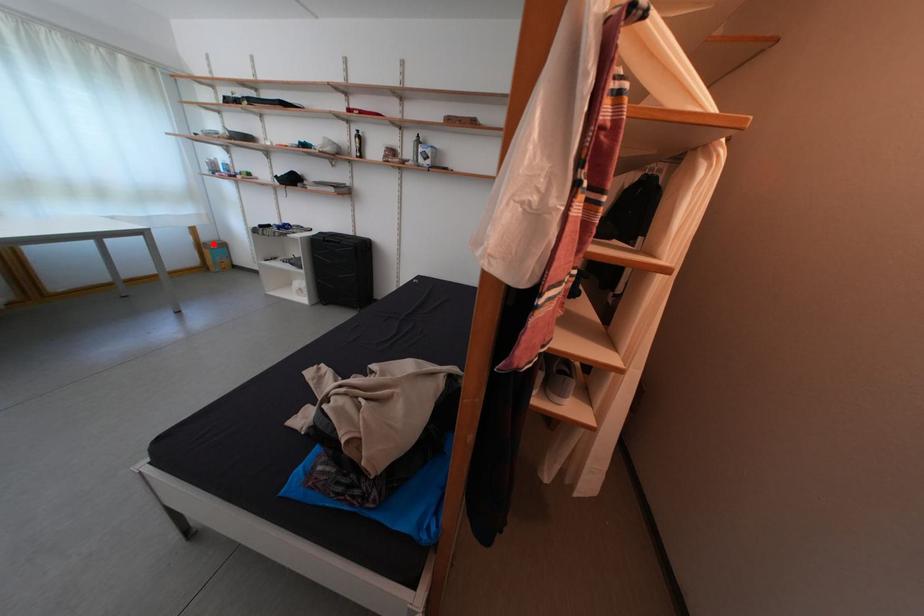
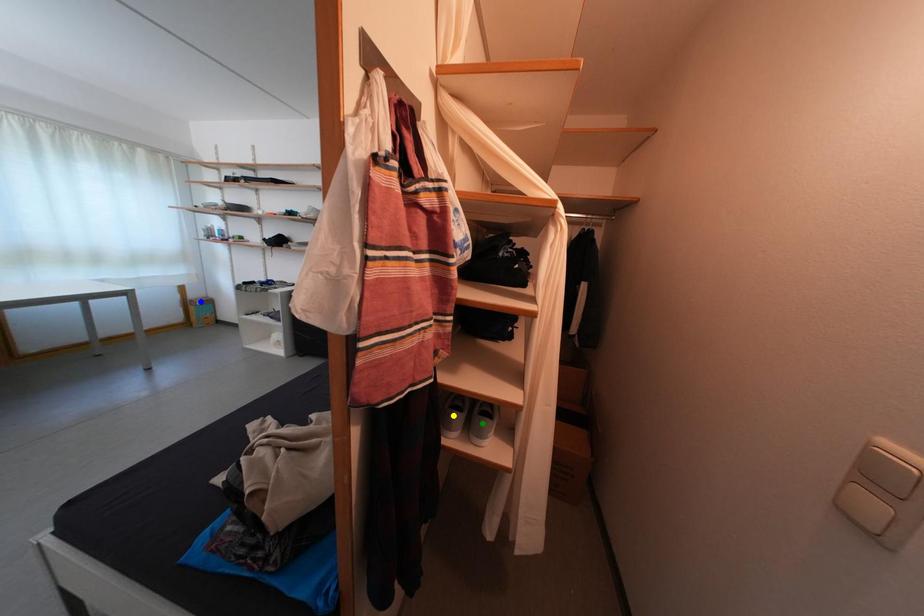
Question: I am providing you with two images of the same scene from different viewpoints. A red point is marked on the first image. You are given multiple points on the second image. Which point in image 2 represents the same 3d spot as the red point in image 1?

Choices:
 (A) yellow point
 (B) blue point
 (C) green point

Answer: (B)